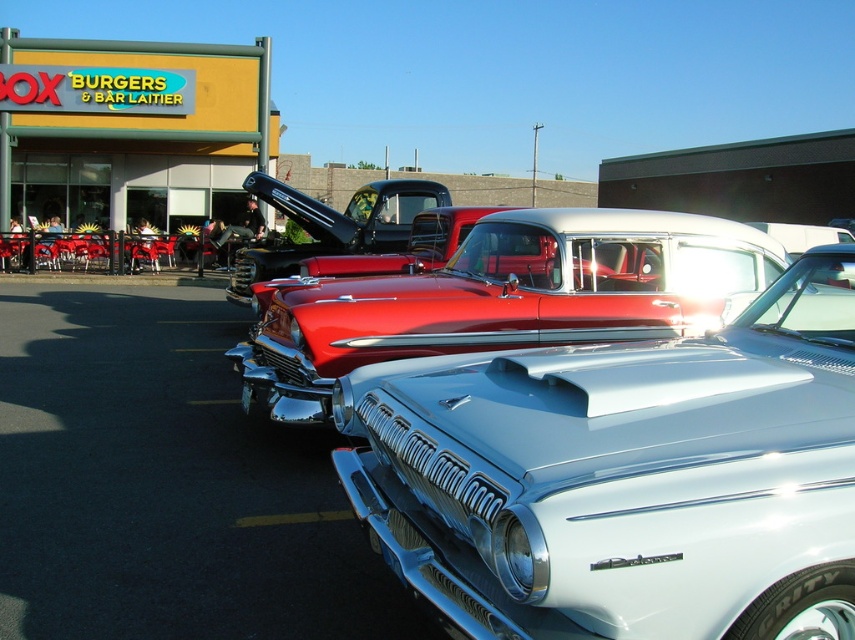
Question: Can you confirm if yellow sign at upper left is positioned above shiny red pickup truck at center?

Choices:
 (A) yes
 (B) no

Answer: (A)

Question: Based on their relative distances, which object is farther from the yellow sign at upper left?

Choices:
 (A) glossy red pickup truck at center
 (B) metallic silver car at center
 (C) shiny red pickup truck at center

Answer: (B)

Question: Which object is farther from the camera taking this photo?

Choices:
 (A) glossy red pickup truck at center
 (B) yellow sign at upper left

Answer: (B)

Question: Can you confirm if glossy red pickup truck at center is positioned to the right of shiny red pickup truck at center?

Choices:
 (A) no
 (B) yes

Answer: (B)

Question: From the image, what is the correct spatial relationship of metallic silver car at center in relation to shiny red pickup truck at center?

Choices:
 (A) right
 (B) left

Answer: (A)

Question: Which point is farther from the camera taking this photo?

Choices:
 (A) (700, 376)
 (B) (376, 256)
 (C) (216, 67)
 (D) (293, 356)

Answer: (C)